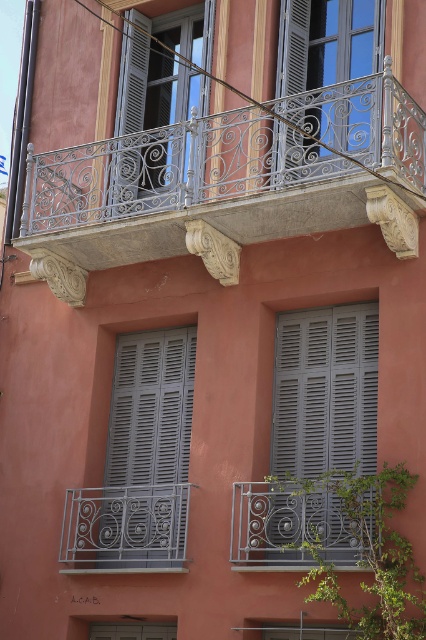
Is gray matte shutters at center shorter than matte gray metal window at upper center?

Correct, gray matte shutters at center is not as tall as matte gray metal window at upper center.

The height and width of the screenshot is (640, 426). Find the location of `gray matte shutters at center`. gray matte shutters at center is located at coordinates (325, 392).

Is white wrought iron balcony at upper center to the right of gray matte shutter at center from the viewer's perspective?

Correct, you'll find white wrought iron balcony at upper center to the right of gray matte shutter at center.

Is white wrought iron balcony at upper center taller than gray matte shutter at center?

Yes, white wrought iron balcony at upper center is taller than gray matte shutter at center.

Between point (299, 134) and point (180, 504), which one is positioned behind?

The point (180, 504) is behind.

You are a GUI agent. You are given a task and a screenshot of the screen. Output one action in this format:
    pyautogui.click(x=<x>, y=<y>)
    Task: Click on the white wrought iron balcony at upper center
    The height and width of the screenshot is (640, 426).
    Given the screenshot: What is the action you would take?
    pyautogui.click(x=184, y=189)

Does gray matte shutter at center appear over matte gray window at upper center?

No.

Which is more to the left, gray matte shutter at center or matte gray window at upper center?

matte gray window at upper center

What do you see at coordinates (147, 451) in the screenshot? I see `gray matte shutter at center` at bounding box center [147, 451].

Identify the location of gray matte shutter at center. The image size is (426, 640). (147, 451).